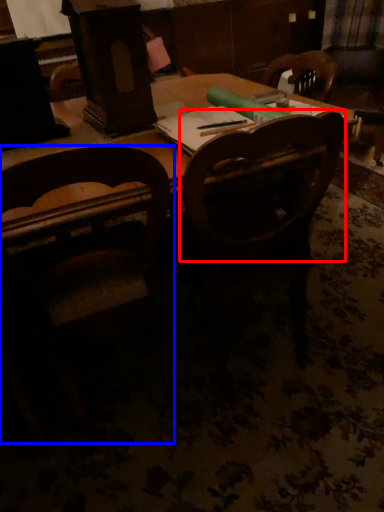
Question: Among these objects, which one is farthest to the camera, chair (highlighted by a red box) or chair (highlighted by a blue box)?

Choices:
 (A) chair
 (B) chair

Answer: (A)